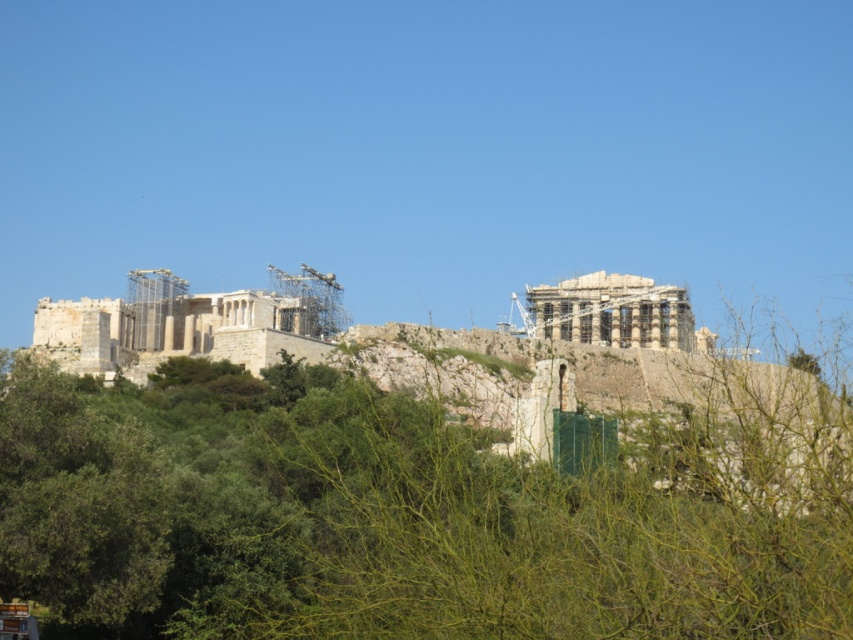
Is stone classical temple at left bigger than white stone temple at upper right?

Yes, stone classical temple at left is bigger than white stone temple at upper right.

Is stone classical temple at left closer to the viewer compared to white stone temple at upper right?

Yes, it is in front of white stone temple at upper right.

Who is more distant from viewer, [247,337] or [688,337]?

The point [688,337] is more distant.

You are a GUI agent. You are given a task and a screenshot of the screen. Output one action in this format:
    pyautogui.click(x=<x>, y=<y>)
    Task: Click on the stone classical temple at left
    Image resolution: width=853 pixels, height=640 pixels.
    Given the screenshot: What is the action you would take?
    pyautogui.click(x=190, y=324)